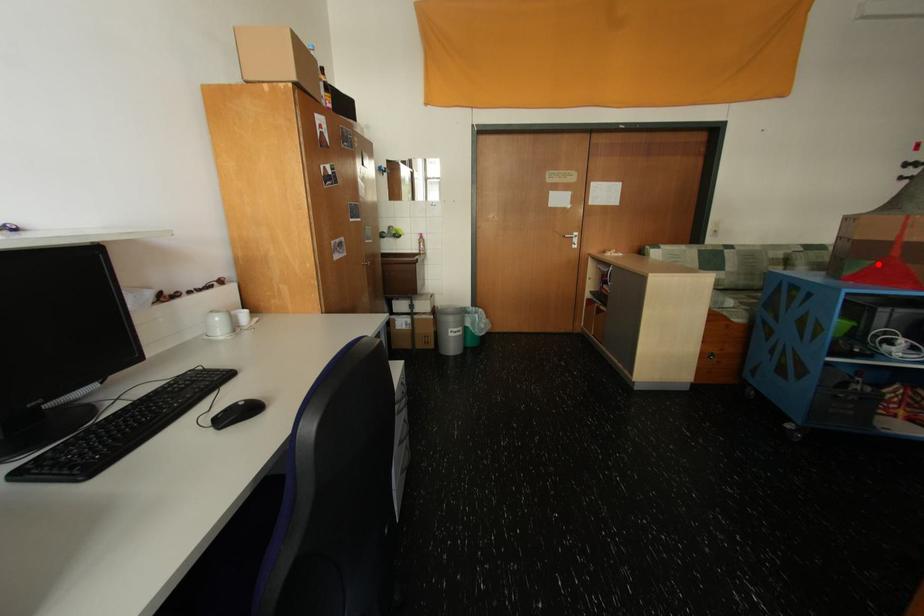
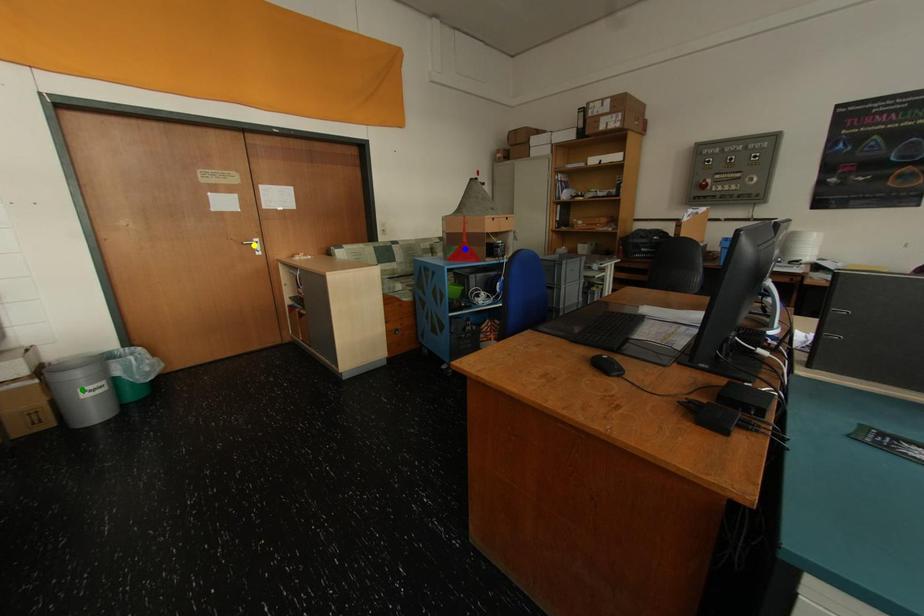
Question: I am providing you with two images of the same scene from different viewpoints. A red point is marked on the first image. You are given multiple points on the second image. In image 2, which mark is for the same physical point as the one in image 1?

Choices:
 (A) yellow point
 (B) blue point
 (C) green point

Answer: (B)